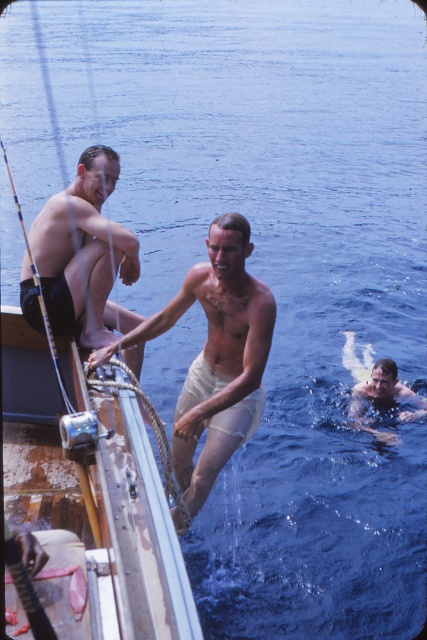
You are a photographer taking a picture of the scene. You notice the matte black shorts at left and the smooth skin man at lower right. Which object is covering part of the other?

The matte black shorts at left is positioned over smooth skin man at lower right, so the matte black shorts at left is covering part of the smooth skin man at lower right.